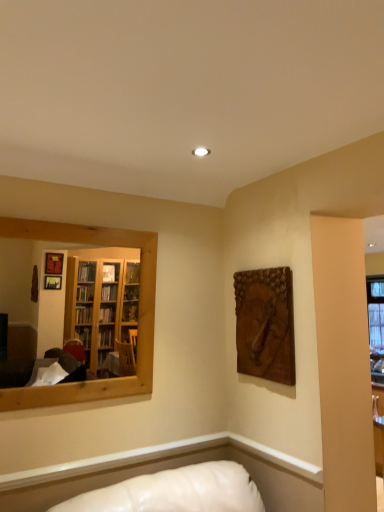
Identify the location of wooden mirror at left. The height and width of the screenshot is (512, 384). (138, 318).

The width and height of the screenshot is (384, 512). Describe the element at coordinates (138, 318) in the screenshot. I see `wooden mirror at left` at that location.

Where is `wooden carving at upper right`? wooden carving at upper right is located at coordinates [x=265, y=324].

This screenshot has height=512, width=384. Describe the element at coordinates (265, 324) in the screenshot. I see `wooden carving at upper right` at that location.

Locate an element on the screen. The width and height of the screenshot is (384, 512). wooden mirror at left is located at coordinates (138, 318).

Consider the image. Considering the relative positions of wooden mirror at left and wooden carving at upper right in the image provided, is wooden mirror at left to the right of wooden carving at upper right from the viewer's perspective?

Incorrect, wooden mirror at left is not on the right side of wooden carving at upper right.

Considering the relative positions of wooden mirror at left and wooden carving at upper right in the image provided, is wooden mirror at left behind wooden carving at upper right?

No, it is not.

Which point is more forward, (16, 232) or (245, 373)?

Positioned in front is point (16, 232).

From the picture: From the image's perspective, which one is positioned higher, wooden mirror at left or wooden carving at upper right?

wooden mirror at left, from the image's perspective.

From a real-world perspective, is wooden mirror at left beneath wooden carving at upper right?

Incorrect, from a real-world perspective, wooden mirror at left is higher than wooden carving at upper right.

Is wooden mirror at left wider or thinner than wooden carving at upper right?

Clearly, wooden mirror at left has more width compared to wooden carving at upper right.

Based on the photo, from their relative heights in the image, would you say wooden mirror at left is taller or shorter than wooden carving at upper right?

Considering their sizes, wooden mirror at left has more height than wooden carving at upper right.

Is wooden mirror at left bigger or smaller than wooden carving at upper right?

Considering their sizes, wooden mirror at left takes up more space than wooden carving at upper right.

Looking at this image, choose the correct answer: Is wooden mirror at left inside wooden carving at upper right or outside it?

wooden mirror at left exists outside the volume of wooden carving at upper right.

Is wooden mirror at left next to wooden carving at upper right and touching it?

wooden mirror at left and wooden carving at upper right are clearly separated.

Could you tell me if wooden mirror at left is facing wooden carving at upper right?

No, wooden mirror at left is not oriented towards wooden carving at upper right.

What's the angular difference between wooden mirror at left and wooden carving at upper right's facing directions?

The angular difference between wooden mirror at left and wooden carving at upper right is 90.2 degrees.

Measure the distance from wooden mirror at left to wooden carving at upper right.

wooden mirror at left and wooden carving at upper right are 23.35 inches apart.

Identify the location of mirror that appears in front of the wooden carving at upper right. The width and height of the screenshot is (384, 512). (138, 318).

Can you confirm if wooden carving at upper right is positioned to the left of wooden mirror at left?

In fact, wooden carving at upper right is to the right of wooden mirror at left.

In the image, is wooden carving at upper right positioned in front of or behind wooden mirror at left?

Clearly, wooden carving at upper right is behind wooden mirror at left.

Between point (263, 373) and point (71, 394), which one is positioned in front?

The point (71, 394) is in front.

From the image's perspective, between wooden carving at upper right and wooden mirror at left, who is located below?

wooden carving at upper right, from the image's perspective.

From a real-world perspective, is wooden carving at upper right above or below wooden mirror at left?

From a real-world perspective, wooden carving at upper right is physically below wooden mirror at left.

Considering the relative sizes of wooden carving at upper right and wooden mirror at left in the image provided, is wooden carving at upper right wider than wooden mirror at left?

In fact, wooden carving at upper right might be narrower than wooden mirror at left.

Considering the sizes of objects wooden carving at upper right and wooden mirror at left in the image provided, who is shorter, wooden carving at upper right or wooden mirror at left?

wooden carving at upper right.

Is wooden carving at upper right smaller than wooden mirror at left?

Indeed, wooden carving at upper right has a smaller size compared to wooden mirror at left.

Is wooden mirror at left located within wooden carving at upper right?

No, wooden mirror at left is not surrounded by wooden carving at upper right.

Are wooden carving at upper right and wooden mirror at left making contact?

There is a gap between wooden carving at upper right and wooden mirror at left.

Is wooden carving at upper right looking in the opposite direction of wooden mirror at left?

wooden carving at upper right does not have its back to wooden mirror at left.

Measure the distance from wooden carving at upper right to wooden mirror at left.

wooden carving at upper right and wooden mirror at left are 59.31 centimeters apart.

Where is `mirror above the wooden carving at upper right (from the image's perspective)`? mirror above the wooden carving at upper right (from the image's perspective) is located at coordinates (138, 318).

Find the location of a particular element. The width and height of the screenshot is (384, 512). picture frame that appears on the right of wooden mirror at left is located at coordinates (265, 324).

Identify the location of mirror above the wooden carving at upper right (from the image's perspective). The width and height of the screenshot is (384, 512). (138, 318).